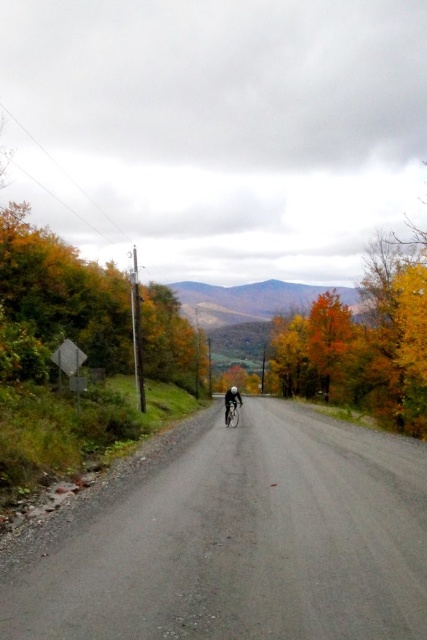
You are standing at the starting point of the road and want to reach the cyclist who is ahead on the gray gravel road at center. What direction should you move in to stay on the road?

You should move forward along the gray gravel road at center, which stretches straight ahead and curves slightly to the right in the distance, to reach the cyclist.

You are a pedestrian standing on the side of the road and see the yellow leafy tree at center and the shiny metallic bicycle at center. Which object is closer to the right side of the road?

The yellow leafy tree at center is positioned on the right side of the shiny metallic bicycle at center, so the yellow leafy tree at center is closer to the right side of the road.

You are a hiker planning to cross the gray gravel road at center while avoiding the yellow leafy tree at center. Given their sizes, which one should you prioritize navigating around?

The gray gravel road at center has a lesser width compared to the yellow leafy tree at center, so you should prioritize navigating around the gray gravel road at center since it is narrower and may require more careful maneuvering.